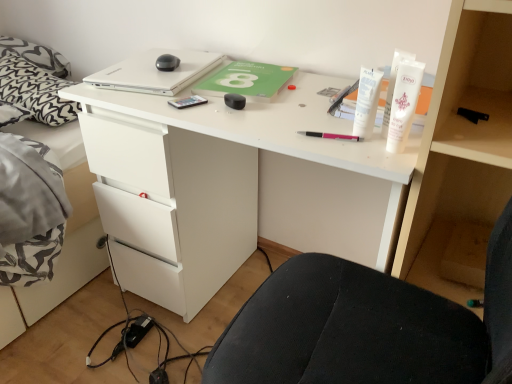
Where is `unoccupied space behind satin silver phone at center, positioned as the 1th stationery in left-to-right order`? This screenshot has width=512, height=384. unoccupied space behind satin silver phone at center, positioned as the 1th stationery in left-to-right order is located at coordinates (194, 93).